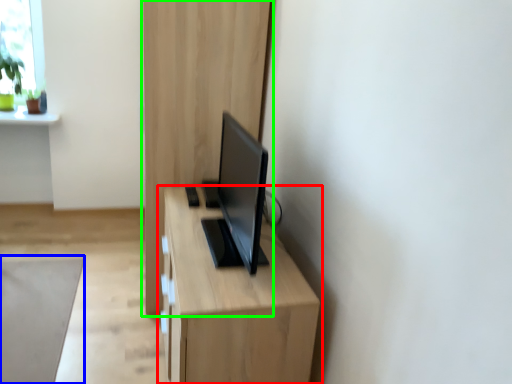
Question: Which object is the closest to the table (highlighted by a red box)? Choose among these: plain (highlighted by a blue box) or dresser (highlighted by a green box).

Choices:
 (A) plain
 (B) dresser

Answer: (B)